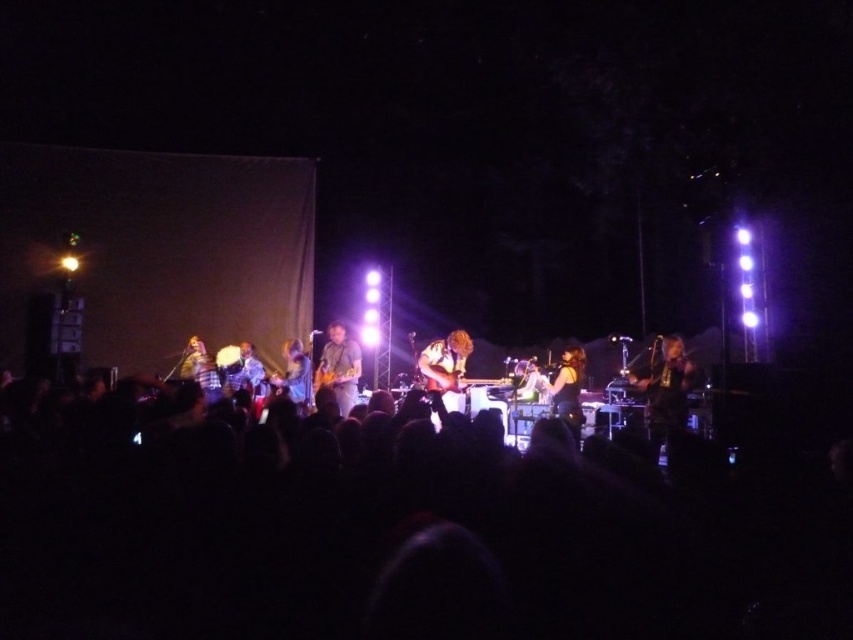
Question: Is the position of shiny black guitar at right less distant than that of light brown leather guitar at center?

Choices:
 (A) yes
 (B) no

Answer: (A)

Question: Which object is positioned closest to the shiny brown guitar at center?

Choices:
 (A) matte black guitar at center
 (B) shiny silver guitar at center
 (C) black fabric crowd at lower center

Answer: (B)

Question: Observing the image, what is the correct spatial positioning of black fabric crowd at lower center in reference to shiny brown guitar at center?

Choices:
 (A) right
 (B) left

Answer: (B)

Question: Does shiny black guitar at right appear under shiny silver guitar at center?

Choices:
 (A) no
 (B) yes

Answer: (B)

Question: Which point appears closest to the camera in this image?

Choices:
 (A) (216, 364)
 (B) (549, 388)
 (C) (349, 380)
 (D) (659, 360)

Answer: (D)

Question: Which point appears closest to the camera in this image?

Choices:
 (A) (346, 392)
 (B) (306, 404)
 (C) (445, 397)

Answer: (B)